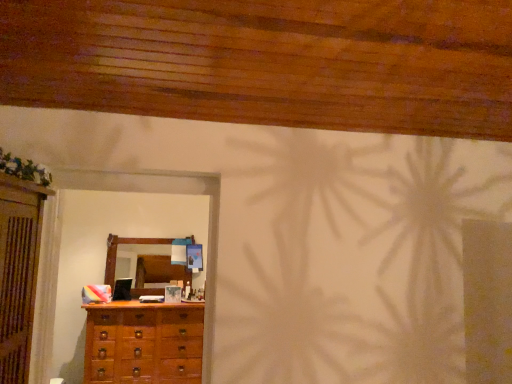
Find the location of a particular element. The height and width of the screenshot is (384, 512). wooden chest of drawers at lower left is located at coordinates (144, 343).

The image size is (512, 384). Describe the element at coordinates (144, 343) in the screenshot. I see `wooden chest of drawers at lower left` at that location.

The height and width of the screenshot is (384, 512). What are the coordinates of `wooden mirror at center` in the screenshot? It's located at (154, 264).

What is the approximate height of wooden mirror at center?

75.44 centimeters.

Describe the element at coordinates (154, 264) in the screenshot. Image resolution: width=512 pixels, height=384 pixels. I see `wooden mirror at center` at that location.

This screenshot has height=384, width=512. What are the coordinates of `wooden chest of drawers at lower left` in the screenshot? It's located at (144, 343).

Which is more to the left, wooden mirror at center or wooden chest of drawers at lower left?

Positioned to the left is wooden mirror at center.

From the picture: Is the depth of wooden mirror at center less than that of wooden chest of drawers at lower left?

No, it is behind wooden chest of drawers at lower left.

Considering the points (174, 278) and (150, 344), which point is in front, point (174, 278) or point (150, 344)?

The point (150, 344) is closer to the camera.

From the image's perspective, between wooden mirror at center and wooden chest of drawers at lower left, which one is located above?

wooden mirror at center is shown above in the image.

From the picture: From a real-world perspective, is wooden mirror at center under wooden chest of drawers at lower left?

Actually, wooden mirror at center is physically above wooden chest of drawers at lower left in the real world.

Is wooden mirror at center wider than wooden chest of drawers at lower left?

In fact, wooden mirror at center might be narrower than wooden chest of drawers at lower left.

Is wooden mirror at center taller or shorter than wooden chest of drawers at lower left?

wooden mirror at center is shorter than wooden chest of drawers at lower left.

Does wooden mirror at center have a smaller size compared to wooden chest of drawers at lower left?

Yes, wooden mirror at center is smaller than wooden chest of drawers at lower left.

Is wooden mirror at center positioned beyond the bounds of wooden chest of drawers at lower left?

Yes, wooden mirror at center is located beyond the bounds of wooden chest of drawers at lower left.

Is wooden mirror at center beside wooden chest of drawers at lower left?

No, wooden mirror at center is not with wooden chest of drawers at lower left.

Is wooden chest of drawers at lower left at the back of wooden mirror at center?

No, wooden mirror at center is not facing the opposite direction of wooden chest of drawers at lower left.

How many degrees apart are the facing directions of wooden mirror at center and wooden chest of drawers at lower left?

wooden mirror at center and wooden chest of drawers at lower left are facing 0.174 degrees away from each other.

Locate an element on the screen. This screenshot has height=384, width=512. the chest of drawers lying below the wooden mirror at center (from the image's perspective) is located at coordinates (144, 343).

Is wooden chest of drawers at lower left to the right of wooden mirror at center from the viewer's perspective?

Yes.

Between wooden chest of drawers at lower left and wooden mirror at center, which one is positioned in front?

wooden chest of drawers at lower left is in front.

Does point (142, 379) appear closer or farther from the camera than point (127, 249)?

Point (142, 379) is closer to the camera than point (127, 249).

From the image's perspective, is wooden chest of drawers at lower left located above wooden mirror at center?

No, from the image's perspective, wooden chest of drawers at lower left is not on top of wooden mirror at center.

In the scene shown: From a real-world perspective, who is located higher, wooden chest of drawers at lower left or wooden mirror at center?

From a 3D spatial view, wooden mirror at center is above.

Which of these two, wooden chest of drawers at lower left or wooden mirror at center, is thinner?

Thinner between the two is wooden mirror at center.

Considering the relative sizes of wooden chest of drawers at lower left and wooden mirror at center in the image provided, is wooden chest of drawers at lower left shorter than wooden mirror at center?

No.

Is wooden chest of drawers at lower left bigger than wooden mirror at center?

Yes.

Based on the photo, can wooden mirror at center be found inside wooden chest of drawers at lower left?

That's incorrect, wooden mirror at center is not inside wooden chest of drawers at lower left.

Is wooden chest of drawers at lower left not near wooden mirror at center?

wooden chest of drawers at lower left is actually quite close to wooden mirror at center.

Is wooden chest of drawers at lower left looking in the opposite direction of wooden mirror at center?

No, wooden mirror at center is not at the back of wooden chest of drawers at lower left.

How many degrees apart are the facing directions of wooden chest of drawers at lower left and wooden mirror at center?

wooden chest of drawers at lower left and wooden mirror at center are facing 0.174 degrees away from each other.

Locate an element on the screen. This screenshot has width=512, height=384. mirror above the wooden chest of drawers at lower left (from the image's perspective) is located at coordinates (154, 264).

At what (x,y) coordinates should I click in order to perform the action: click on the chest of drawers located underneath the wooden mirror at center (from a real-world perspective). Please return your answer as a coordinate pair (x, y). Looking at the image, I should click on (144, 343).

The height and width of the screenshot is (384, 512). I want to click on mirror on the left of wooden chest of drawers at lower left, so click(x=154, y=264).